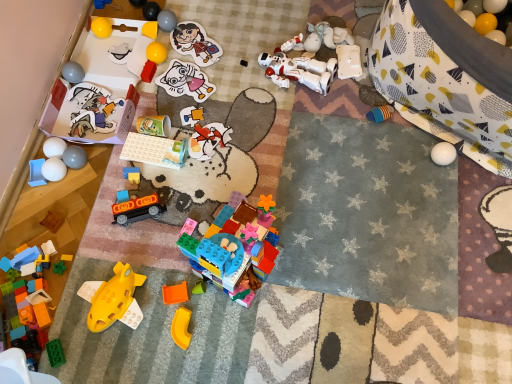
The height and width of the screenshot is (384, 512). I want to click on empty space that is in between yellow rubber ball at upper right, arranged as the 25th toy when viewed from the left, and orange matte train at center, which is the twelfth toy in right-to-left order, so click(x=279, y=145).